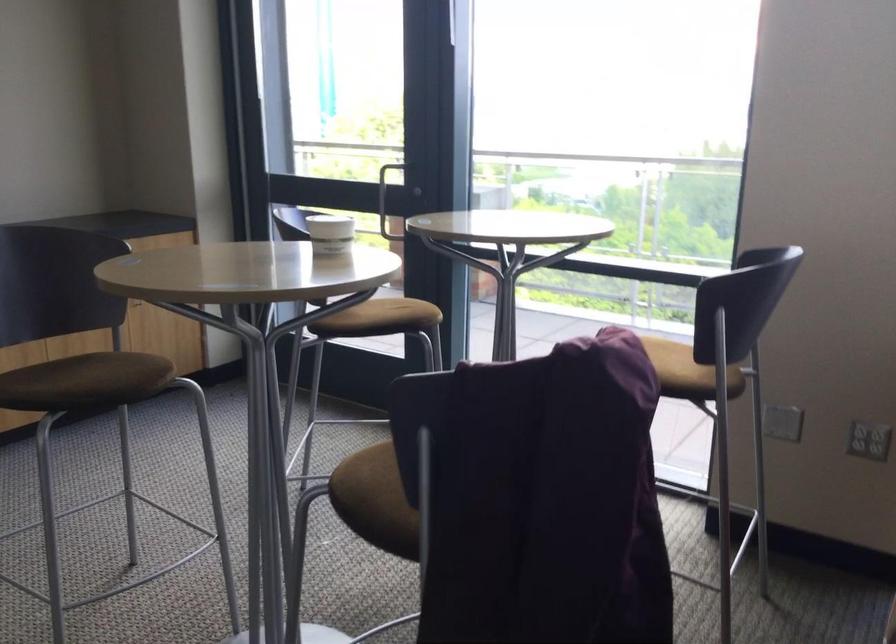
The location [330,234] corresponds to which object?

It refers to a white paper cup.